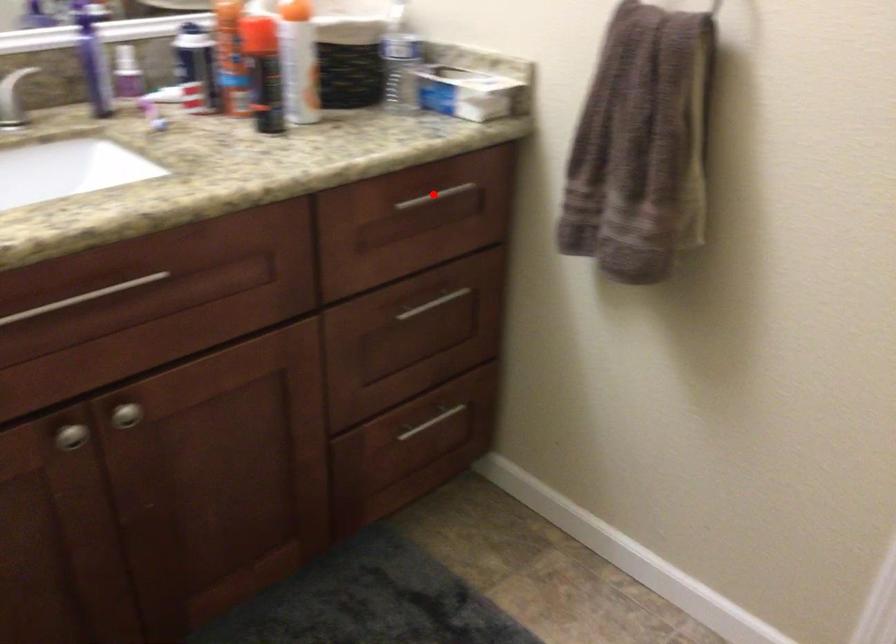
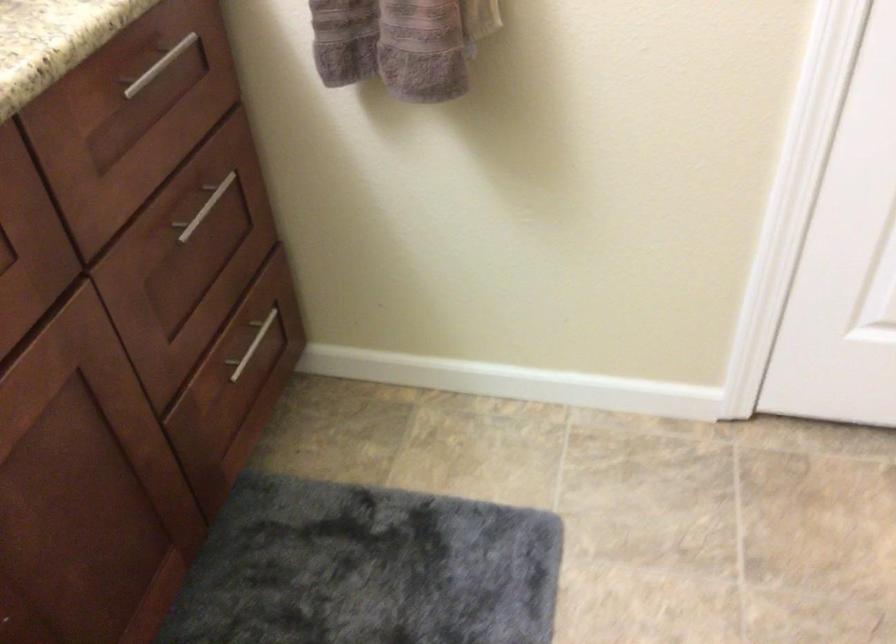
Question: I am providing you with two images of the same scene from different viewpoints. A red point is marked on the first image. Is the red point's position out of view in image 2?

Choices:
 (A) Yes
 (B) No

Answer: (B)